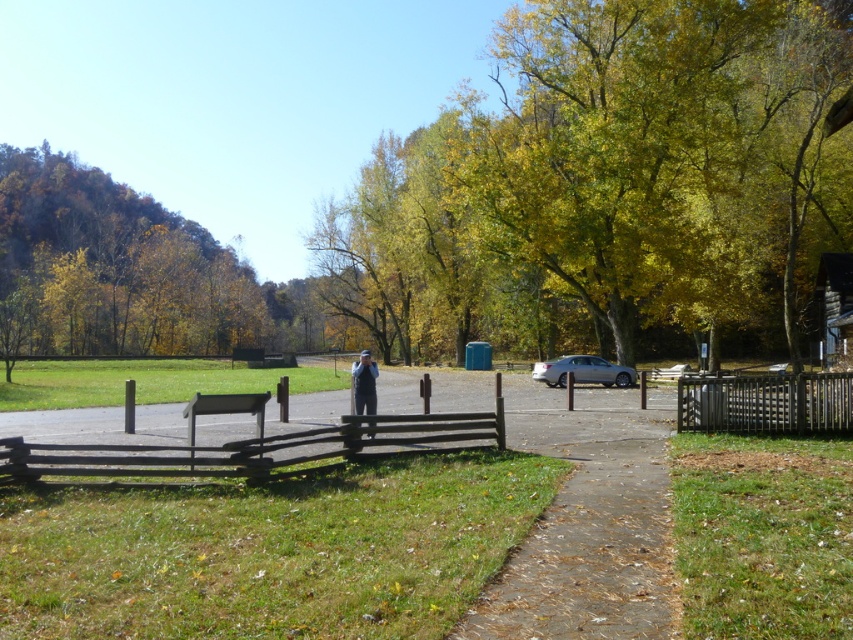
Question: Among these points, which one is farthest from the camera?

Choices:
 (A) (819, 392)
 (B) (364, 390)
 (C) (99, 452)

Answer: (B)

Question: Is wooden fence at center below black wooden fence at right?

Choices:
 (A) no
 (B) yes

Answer: (B)

Question: Among these objects, which one is nearest to the camera?

Choices:
 (A) yellow-green leaves at center
 (B) green leafy trees at upper left
 (C) blue denim jeans at center

Answer: (C)

Question: Which point is closer to the camera taking this photo?

Choices:
 (A) (396, 433)
 (B) (360, 403)
 (C) (463, 625)

Answer: (C)

Question: Is yellow-green leaves at center to the right of gravelly concrete path at center from the viewer's perspective?

Choices:
 (A) yes
 (B) no

Answer: (A)

Question: Is gravelly concrete path at center smaller than black wooden fence at right?

Choices:
 (A) yes
 (B) no

Answer: (B)